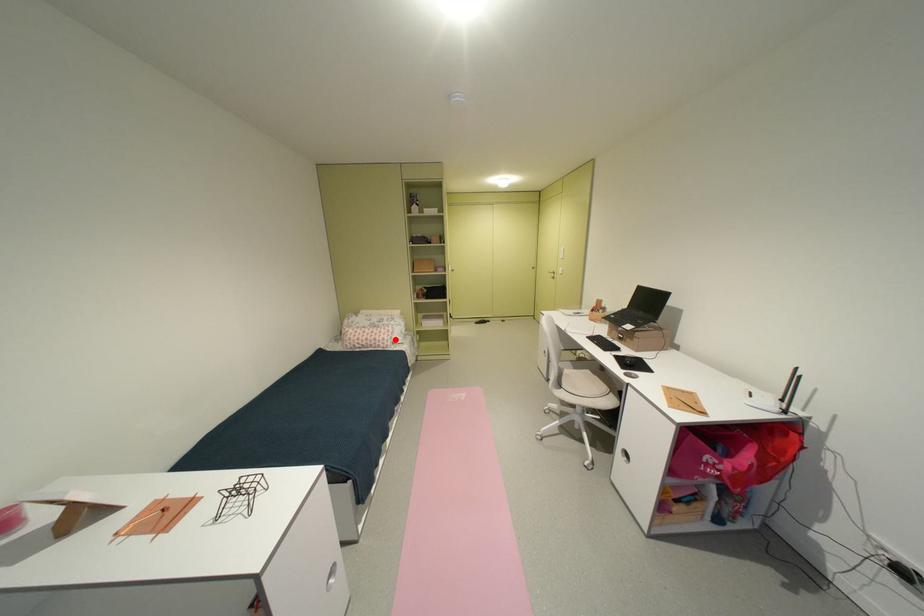
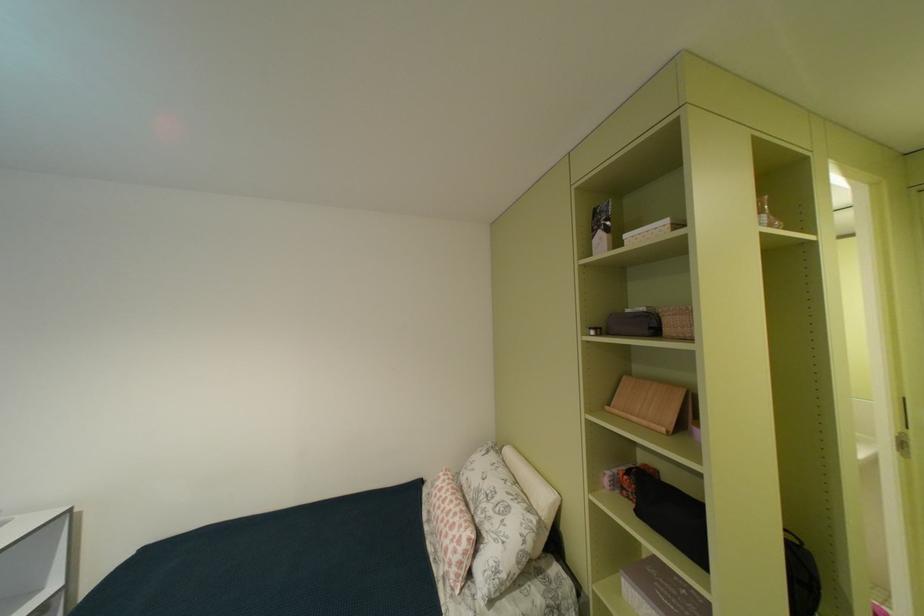
Locate, in the second image, the point that corresponds to the highlighted location in the first image.

(458, 556)